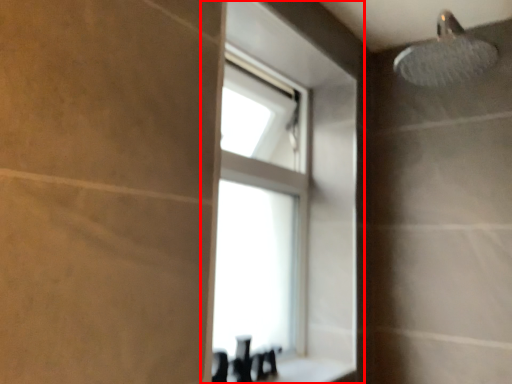
Question: In this image, where is window (annotated by the red box) located relative to counter top?

Choices:
 (A) left
 (B) right

Answer: (A)